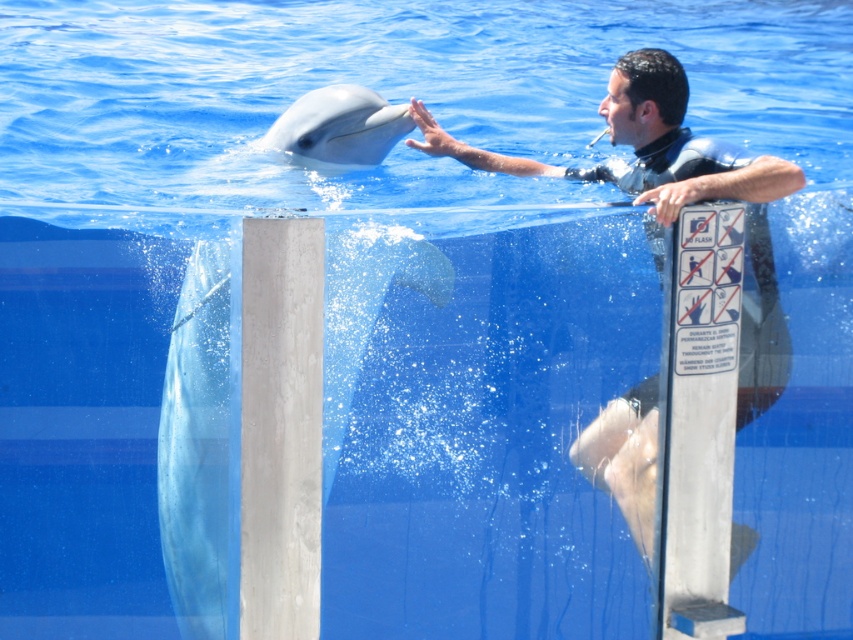
Question: In this image, where is smooth black wetsuit at upper center located relative to white smooth dolphin at center?

Choices:
 (A) right
 (B) left

Answer: (A)

Question: Can you confirm if smooth black wetsuit at upper center is positioned above white smooth dolphin at center?

Choices:
 (A) no
 (B) yes

Answer: (A)

Question: Among these points, which one is farthest from the camera?

Choices:
 (A) (386, 138)
 (B) (608, 480)

Answer: (A)

Question: Which of the following is the farthest from the observer?

Choices:
 (A) pyautogui.click(x=381, y=116)
 (B) pyautogui.click(x=637, y=468)

Answer: (A)

Question: Is smooth black wetsuit at upper center to the right of white smooth dolphin at center from the viewer's perspective?

Choices:
 (A) no
 (B) yes

Answer: (B)

Question: Which of the following is the farthest from the observer?

Choices:
 (A) white smooth dolphin at center
 (B) smooth black wetsuit at upper center

Answer: (A)